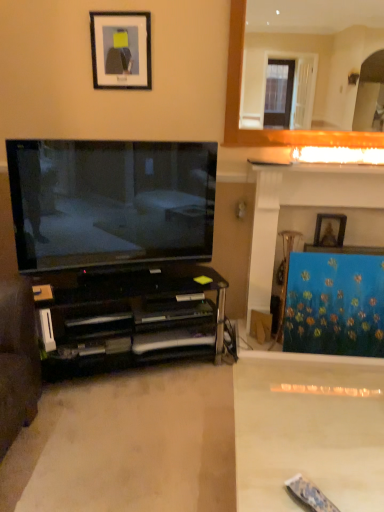
Question: Is white marble fireplace at upper right to the left or to the right of blue textured curtain at right in the image?

Choices:
 (A) left
 (B) right

Answer: (A)

Question: From the image's perspective, is white marble fireplace at upper right positioned above or below blue textured curtain at right?

Choices:
 (A) below
 (B) above

Answer: (B)

Question: Based on their relative distances, which object is nearer to the black glass cabinet at left?

Choices:
 (A) white glossy plain at lower right
 (B) white marble fireplace at upper right
 (C) blue textured curtain at right
 (D) wooden picture frame at upper right, placed as the 1th picture frame when sorted from right to left
 (E) black matte picture frame at upper center, which is counted as the 1th picture frame, starting from the top

Answer: (C)

Question: Estimate the real-world distances between objects in this image. Which object is farther from the white marble fireplace at upper right?

Choices:
 (A) blue textured curtain at right
 (B) white glossy plain at lower right
 (C) wooden picture frame at upper right, the 2th picture frame viewed from the left
 (D) black matte picture frame at upper center, the 1th picture frame from the left
 (E) matte black tv at left

Answer: (B)